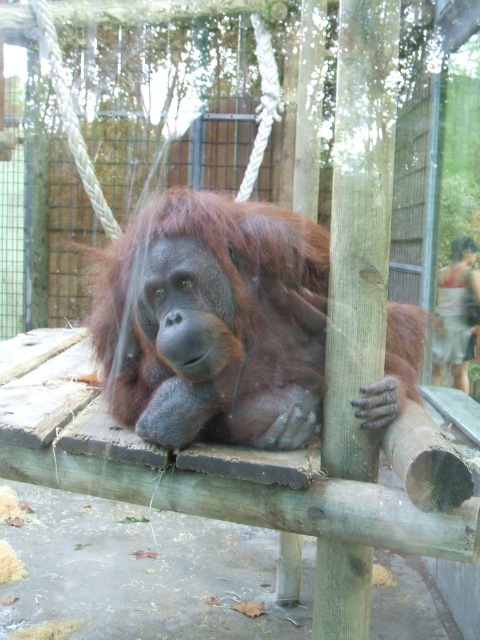
Who is more forward, (x=228, y=218) or (x=465, y=368)?

Point (x=228, y=218) is in front.

Is brown furry orangutan at center taller than light brown fabric shorts at lower right?

Incorrect, brown furry orangutan at center's height is not larger of light brown fabric shorts at lower right's.

Does point (230, 280) lie behind point (439, 269)?

No, it is in front of (439, 269).

Locate an element on the screen. brown furry orangutan at center is located at coordinates (215, 323).

Does brown furry orangutan at center appear on the left side of greenish-brown wood pole at right?

Indeed, brown furry orangutan at center is positioned on the left side of greenish-brown wood pole at right.

Who is shorter, brown furry orangutan at center or greenish-brown wood pole at right?

With less height is brown furry orangutan at center.

Does point (273, 413) lie in front of point (354, 108)?

No, it is behind (354, 108).

At what (x,y) coordinates should I click in order to perform the action: click on brown furry orangutan at center. Please return your answer as a coordinate pair (x, y). The width and height of the screenshot is (480, 640). Looking at the image, I should click on (215, 323).

Is greenish-brown wood pole at right below light brown fabric shorts at lower right?

Indeed, greenish-brown wood pole at right is positioned under light brown fabric shorts at lower right.

Between greenish-brown wood pole at right and light brown fabric shorts at lower right, which one appears on the right side from the viewer's perspective?

light brown fabric shorts at lower right

I want to click on greenish-brown wood pole at right, so click(x=360, y=228).

Find the location of a particular element. This screenshot has height=640, width=480. greenish-brown wood pole at right is located at coordinates (360, 228).